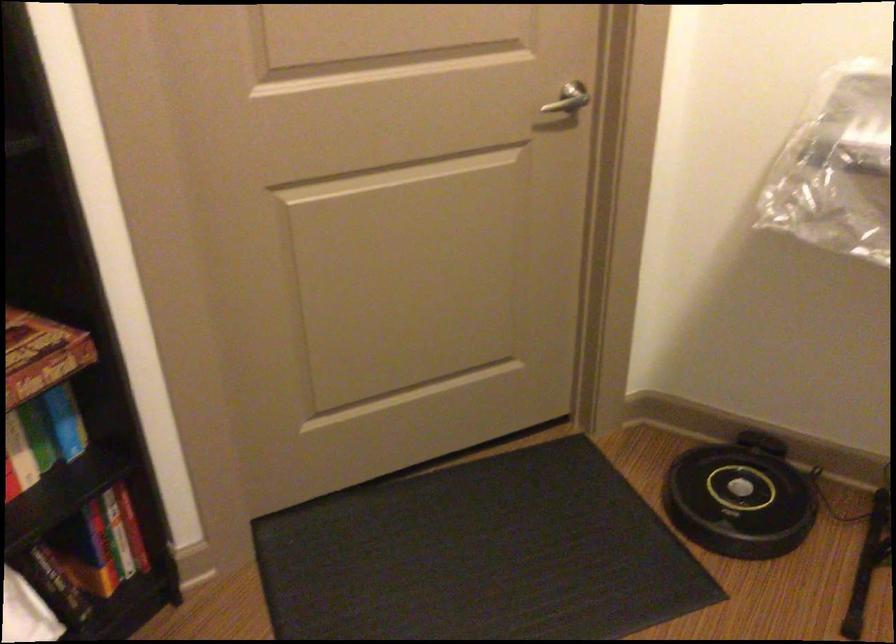
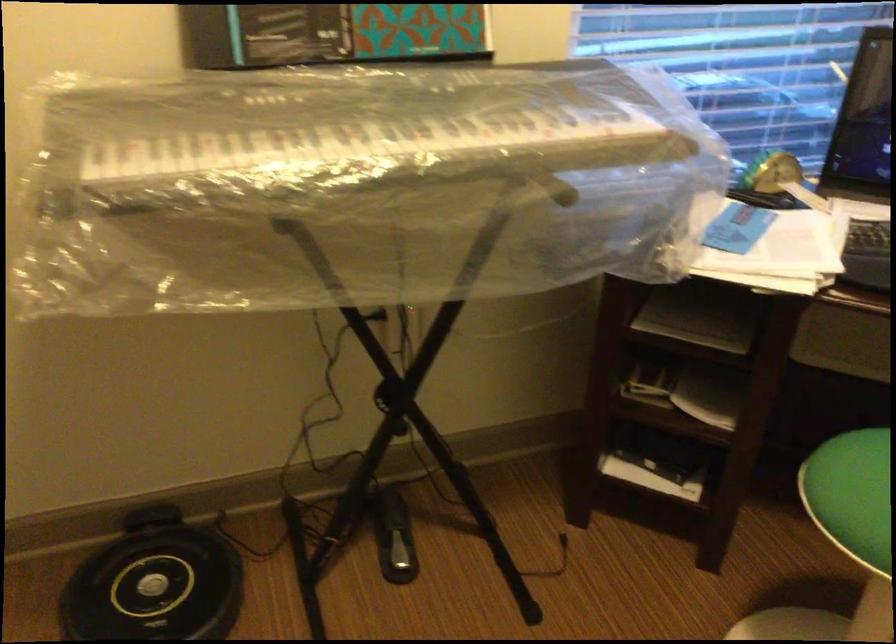
Question: The camera is either moving clockwise (left) or counter-clockwise (right) around the object. The first image is from the beginning of the video and the second image is from the end. Is the camera moving left or right when shooting the video?

Choices:
 (A) Left
 (B) Right

Answer: (A)